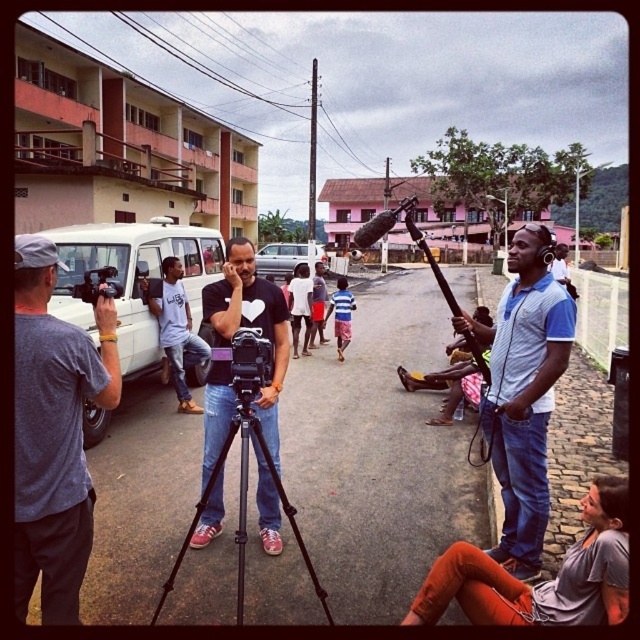
You are a photographer who needs to choose between the white matte camera at center and the black matte camera at center based on their sizes. Which camera is wider?

The white matte camera at center is wider than the black matte camera at center according to the description.

You are a costume designer looking at the scene. You need to determine the spatial relationship between the orange denim pants at lower right and the striped cotton shirt at center. Which one is located lower in the frame?

The orange denim pants at lower right is positioned under the striped cotton shirt at center, so it is located lower in the frame.